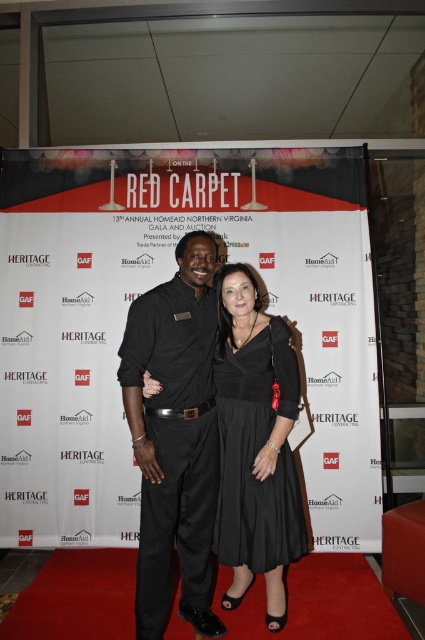
You are a photographer at the event and need to capture a photo where both the black matte dress at center and the black satin dress at center are visible. Since they are the same color, how can you distinguish them in the photo?

The black matte dress at center is taller than the black satin dress at center, so you can distinguish them by their height difference in the photo.